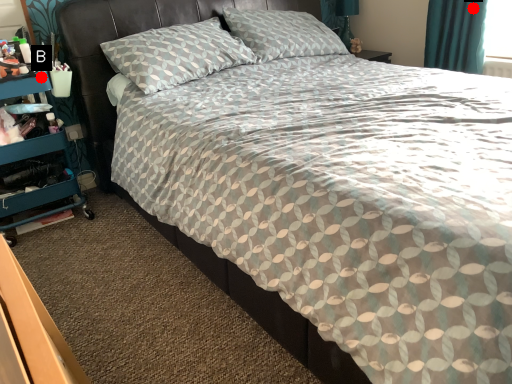
Question: Two points are circled on the image, labeled by A and B beside each circle. Which point appears farthest from the camera in this image?

Choices:
 (A) A is further
 (B) B is further

Answer: (A)